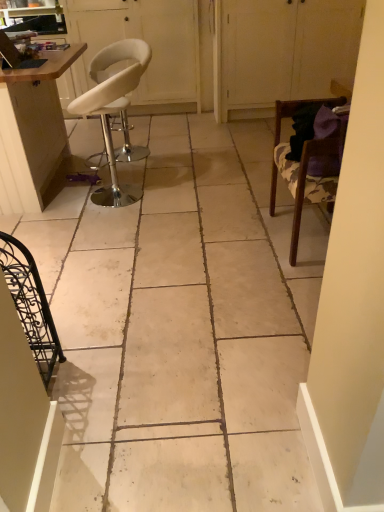
This screenshot has width=384, height=512. I want to click on vacant area that lies to the right of black wrought iron chair at lower left, which appears as the 1th chair when viewed from the front, so click(x=92, y=380).